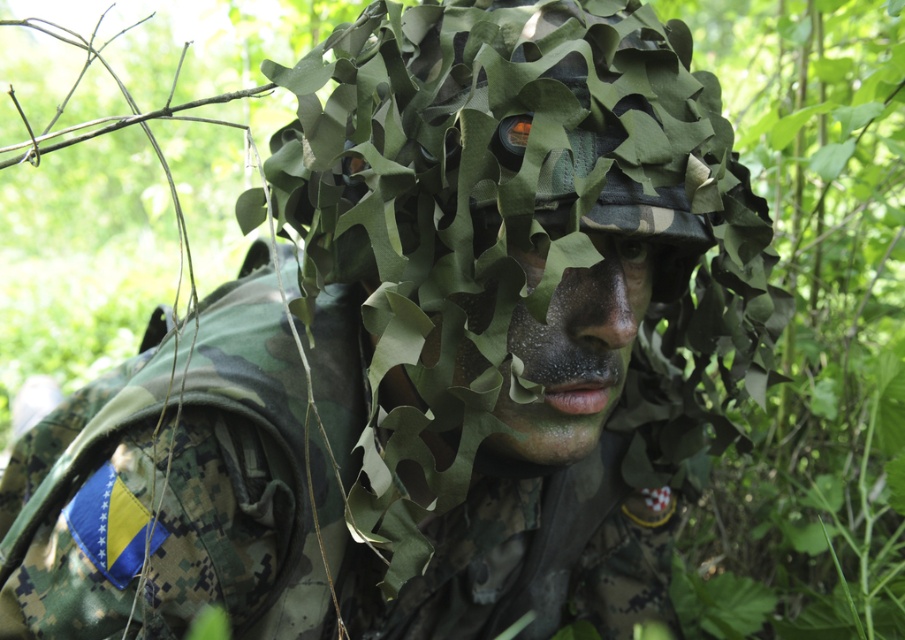
You are a hiker who has spotted a figure in the woods. You see the green leafy netting at center and the camouflage netting at center. Which one is positioned more to the left?

The green leafy netting at center is positioned more to the left than the camouflage netting at center.

You are a photographer trying to capture a clear image of the person in the ghillie suit. You notice two points on their ghillie suit at coordinates point (x=529, y=296) and point (x=611, y=241). Which point should you focus on to ensure it appears sharper in the photo?

Point (x=529, y=296) is closer to the camera than point (x=611, y=241), so focusing on point (x=529, y=296) will result in a sharper image.

In the scene shown: You are a soldier trying to hide in a forest. You have two types of nettings available. The green leafy netting at center and the camouflage netting at center. Which netting should you choose to blend into the forest environment better?

The green leafy netting at center is closer to the viewer than camouflage netting at center, so it would blend better into the forest environment.